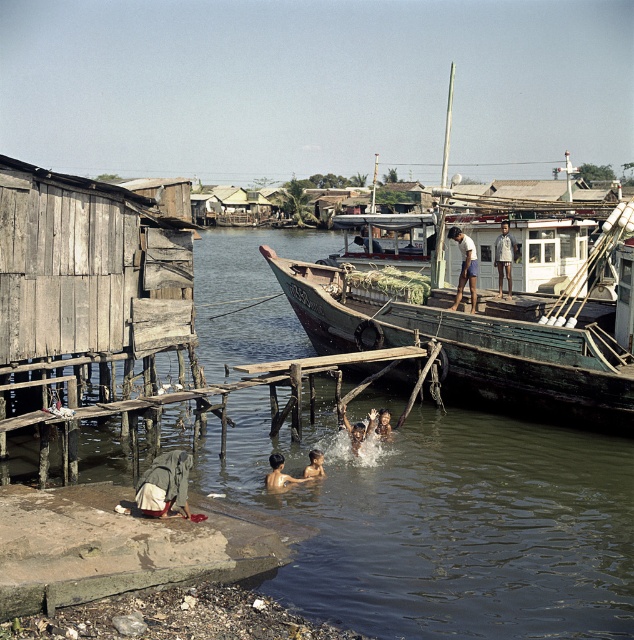
Can you confirm if greenish-brown water at center is smaller than smooth skin child at lower center?

Incorrect, greenish-brown water at center is not smaller in size than smooth skin child at lower center.

Based on the photo, can you confirm if greenish-brown water at center is bigger than smooth skin child at lower center?

Correct, greenish-brown water at center is larger in size than smooth skin child at lower center.

Measure the distance between point (x=585, y=548) and camera.

Point (x=585, y=548) is 12.65 meters from camera.

The image size is (634, 640). Find the location of `greenish-brown water at center`. greenish-brown water at center is located at coordinates (444, 522).

Is point (366, 413) more distant than point (318, 465)?

Yes, point (366, 413) is behind point (318, 465).

Is smooth skin child at lower center smaller than light brown skin at water center?

No.

Between point (366, 417) and point (321, 464), which one is positioned in front?

Point (321, 464)

Where is `smooth skin child at lower center`? smooth skin child at lower center is located at coordinates (356, 428).

Which is more to the left, green wooden boat at center or white cotton shirt at upper center?

Positioned to the left is white cotton shirt at upper center.

Which is in front, point (583, 371) or point (474, 291)?

Positioned in front is point (583, 371).

Locate an element on the screen. green wooden boat at center is located at coordinates (477, 352).